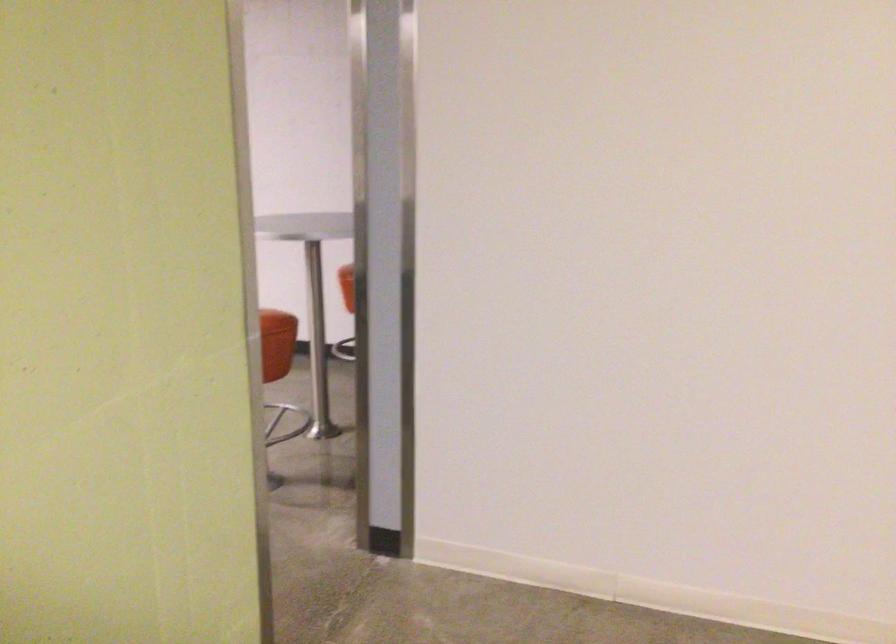
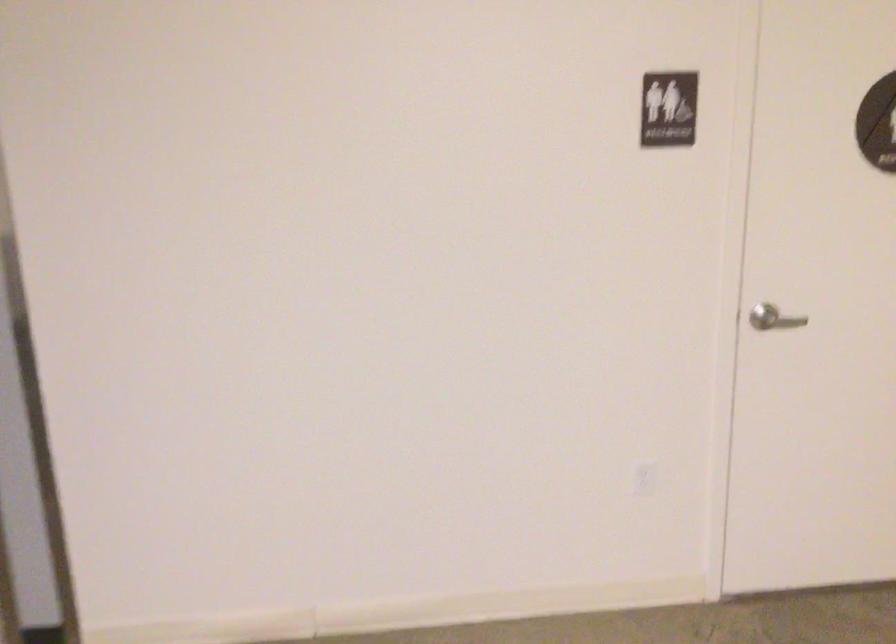
Question: The camera is either moving clockwise (left) or counter-clockwise (right) around the object. The first image is from the beginning of the video and the second image is from the end. Is the camera moving left or right when shooting the video?

Choices:
 (A) Left
 (B) Right

Answer: (A)